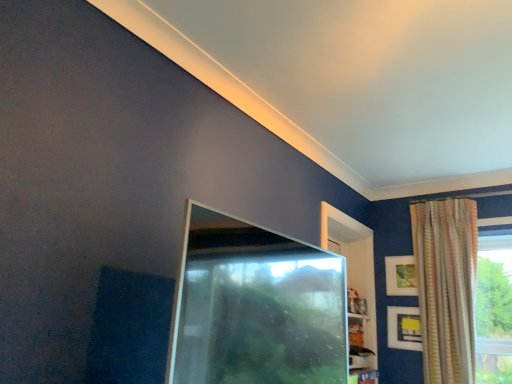
Question: Is matte black picture frame at upper right, acting as the 2th picture frame starting from the top, shorter than transparent glass screen door at center?

Choices:
 (A) yes
 (B) no

Answer: (A)

Question: From a real-world perspective, is matte black picture frame at upper right, which is counted as the 1th picture frame, starting from the bottom, located higher than transparent glass screen door at center?

Choices:
 (A) no
 (B) yes

Answer: (B)

Question: Considering the relative sizes of matte black picture frame at upper right, acting as the 2th picture frame starting from the top, and transparent glass screen door at center in the image provided, is matte black picture frame at upper right, acting as the 2th picture frame starting from the top, smaller than transparent glass screen door at center?

Choices:
 (A) no
 (B) yes

Answer: (B)

Question: Is matte black picture frame at upper right, acting as the 2th picture frame starting from the top, closer to the viewer compared to transparent glass screen door at center?

Choices:
 (A) yes
 (B) no

Answer: (B)

Question: Does matte black picture frame at upper right, which is counted as the 1th picture frame, starting from the bottom, have a larger size compared to transparent glass screen door at center?

Choices:
 (A) no
 (B) yes

Answer: (A)

Question: Would you say matte black picture frame at upper right, which is counted as the 1th picture frame, starting from the bottom, is inside or outside matte gold picture frame at upper right, the 1th picture frame positioned from the top?

Choices:
 (A) outside
 (B) inside

Answer: (A)

Question: From a real-world perspective, is matte black picture frame at upper right, acting as the 2th picture frame starting from the top, positioned above or below matte gold picture frame at upper right, the 1th picture frame positioned from the top?

Choices:
 (A) below
 (B) above

Answer: (A)

Question: In the image, is matte black picture frame at upper right, acting as the 2th picture frame starting from the top, on the left side or the right side of matte gold picture frame at upper right, the 1th picture frame positioned from the top?

Choices:
 (A) left
 (B) right

Answer: (A)

Question: Is matte black picture frame at upper right, acting as the 2th picture frame starting from the top, in front of or behind matte gold picture frame at upper right, which is counted as the 2th picture frame, starting from the bottom, in the image?

Choices:
 (A) behind
 (B) front

Answer: (B)

Question: Considering the positions of transparent glass screen door at center and striped fabric curtain at upper right in the image, is transparent glass screen door at center bigger or smaller than striped fabric curtain at upper right?

Choices:
 (A) small
 (B) big

Answer: (A)

Question: Is transparent glass screen door at center in front of or behind striped fabric curtain at upper right in the image?

Choices:
 (A) front
 (B) behind

Answer: (A)

Question: Is point (268, 382) closer or farther from the camera than point (467, 284)?

Choices:
 (A) closer
 (B) farther

Answer: (A)

Question: From a real-world perspective, is transparent glass screen door at center above or below striped fabric curtain at upper right?

Choices:
 (A) above
 (B) below

Answer: (B)

Question: Considering the positions of striped fabric curtain at upper right and matte gold picture frame at upper right, which is counted as the 2th picture frame, starting from the bottom, in the image, is striped fabric curtain at upper right taller or shorter than matte gold picture frame at upper right, which is counted as the 2th picture frame, starting from the bottom,?

Choices:
 (A) tall
 (B) short

Answer: (A)

Question: Visually, is striped fabric curtain at upper right positioned to the left or to the right of matte gold picture frame at upper right, which is counted as the 2th picture frame, starting from the bottom?

Choices:
 (A) right
 (B) left

Answer: (A)